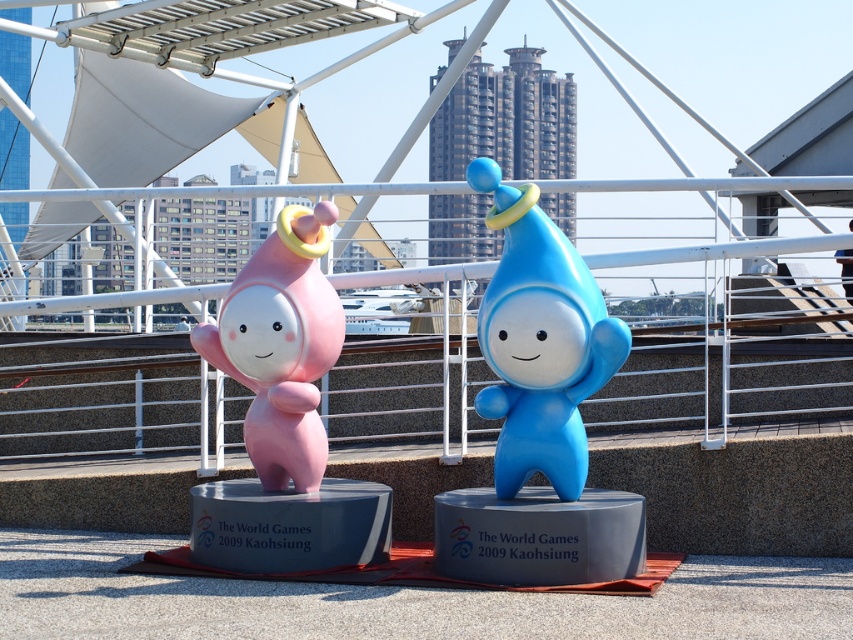
Question: Among these points, which one is farthest from the camera?

Choices:
 (A) (335, 292)
 (B) (550, 305)

Answer: (A)

Question: Does blue glossy toy at center appear under matte pink figure at left?

Choices:
 (A) no
 (B) yes

Answer: (A)

Question: Is the position of blue glossy toy at center more distant than that of matte pink figure at left?

Choices:
 (A) no
 (B) yes

Answer: (A)

Question: Is blue glossy toy at center to the left of matte pink figure at left from the viewer's perspective?

Choices:
 (A) yes
 (B) no

Answer: (B)